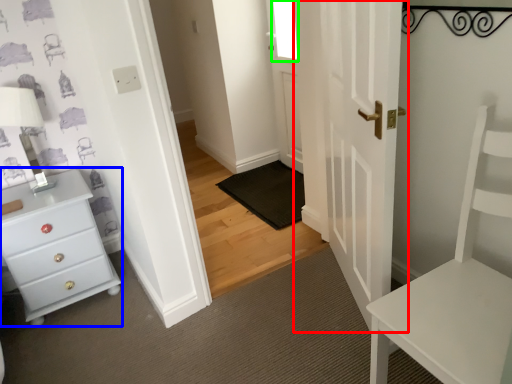
Question: Which is nearer to the door (highlighted by a red box)? chest of drawers (highlighted by a blue box) or window (highlighted by a green box).

Choices:
 (A) chest of drawers
 (B) window

Answer: (B)